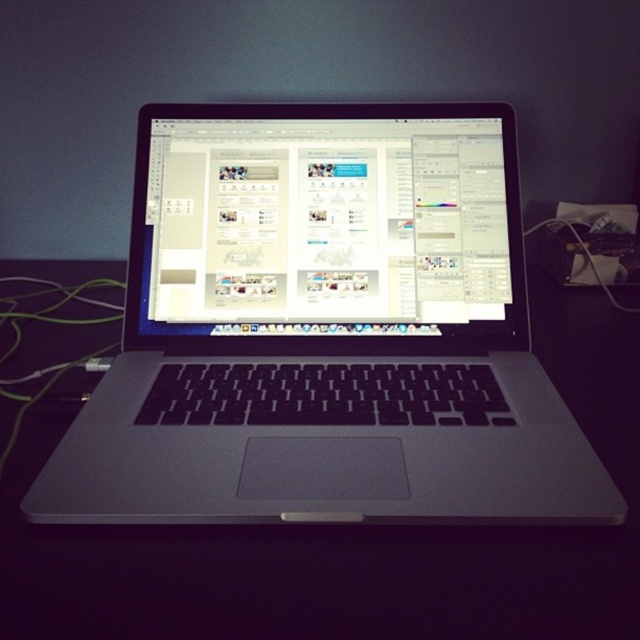
You are organizing a workspace and need to place a 10cm tall paperweight on the black matte table at center. Considering the height of the sleek silver laptop at center, will the paperweight be stable on the table?

The sleek silver laptop at center is taller than the black matte table at center. Since the table is shorter, placing a 10cm tall paperweight on it may cause instability due to the table not providing enough surface height. Ensure the table can support the paperweight properly.

You have a camera that needs to be placed on the black matte table at center. The camera requires a minimum of 14 inches of space to function properly. Can the camera be placed on the table without any issues?

The black matte table at center and camera are 13.74 inches apart, which is less than the required 14 inches. Therefore, placing the camera on the table may cause functionality issues due to insufficient space.

You are organizing your workspace and want to place a small plant on the black matte table at center. However, you need to ensure there is enough space between the table and the satin silver laptop at center. Based on their positions, can you place the plant there?

The black matte table at center is located below the satin silver laptop at center, so placing a plant on the table would be possible as the laptop is positioned above it, leaving space on the table surface.